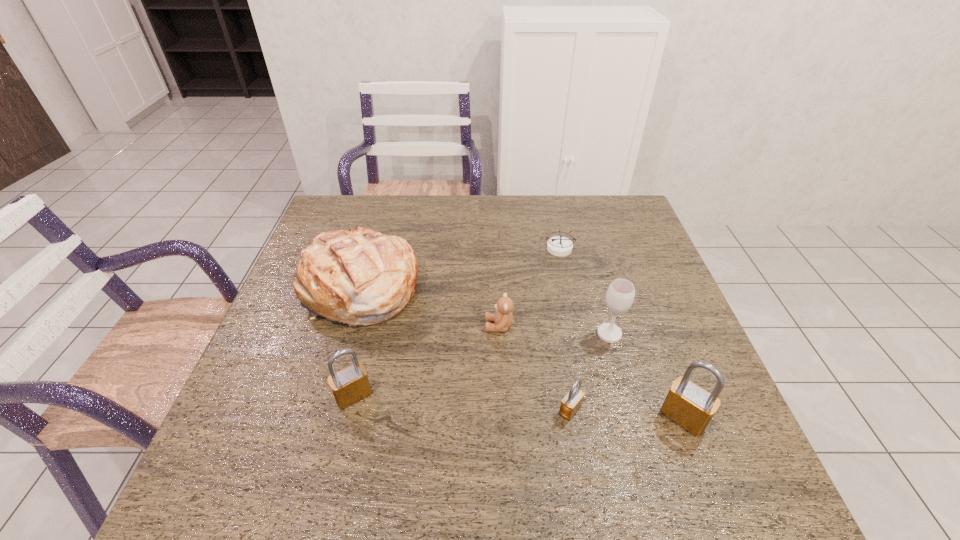
Locate an element on the screen. The height and width of the screenshot is (540, 960). blank region between the compass and the shortest padlock is located at coordinates (564, 329).

Locate an element on the screen. vacant area that lies between the teddy bear and the rightmost padlock is located at coordinates (591, 372).

Locate an element on the screen. This screenshot has height=540, width=960. free spot between the wineglass and the rightmost object is located at coordinates (646, 376).

In order to click on vacant space that's between the shortest object and the shortest padlock in this screenshot , I will do `click(564, 329)`.

Find the location of a particular element. This screenshot has height=540, width=960. vacant region between the fifth object from right to left and the second padlock from right to left is located at coordinates (535, 368).

Identify which object is located as the fourth nearest to the rightmost padlock. Please provide its 2D coordinates. Your answer should be formatted as a tuple, i.e. [(x, y)], where the tuple contains the x and y coordinates of a point satisfying the conditions above.

[(559, 246)]

At what (x,y) coordinates should I click in order to perform the action: click on object that stands as the fourth closest to the second padlock from right to left. Please return your answer as a coordinate pair (x, y). Looking at the image, I should click on (361, 277).

Point out which padlock is positioned as the second nearest to the second tallest padlock. Please provide its 2D coordinates. Your answer should be formatted as a tuple, i.e. [(x, y)], where the tuple contains the x and y coordinates of a point satisfying the conditions above.

[(687, 404)]

Select which padlock appears as the second closest to the wineglass. Please provide its 2D coordinates. Your answer should be formatted as a tuple, i.e. [(x, y)], where the tuple contains the x and y coordinates of a point satisfying the conditions above.

[(571, 403)]

This screenshot has width=960, height=540. In order to click on free region that satisfies the following two spatial constraints: 1. on the face of the third object from left to right; 2. on the back side of the sixth object from left to right in this screenshot , I will do `click(499, 334)`.